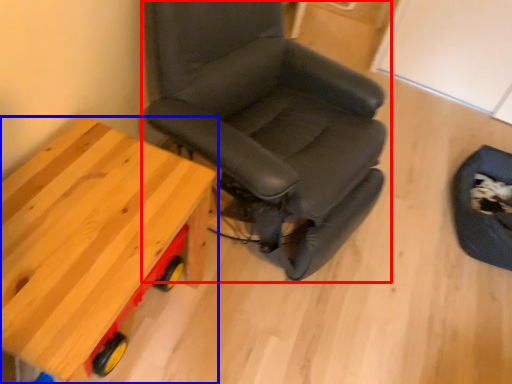
Question: Which point is further to the camera, chair (highlighted by a red box) or table (highlighted by a blue box)?

Choices:
 (A) chair
 (B) table

Answer: (B)